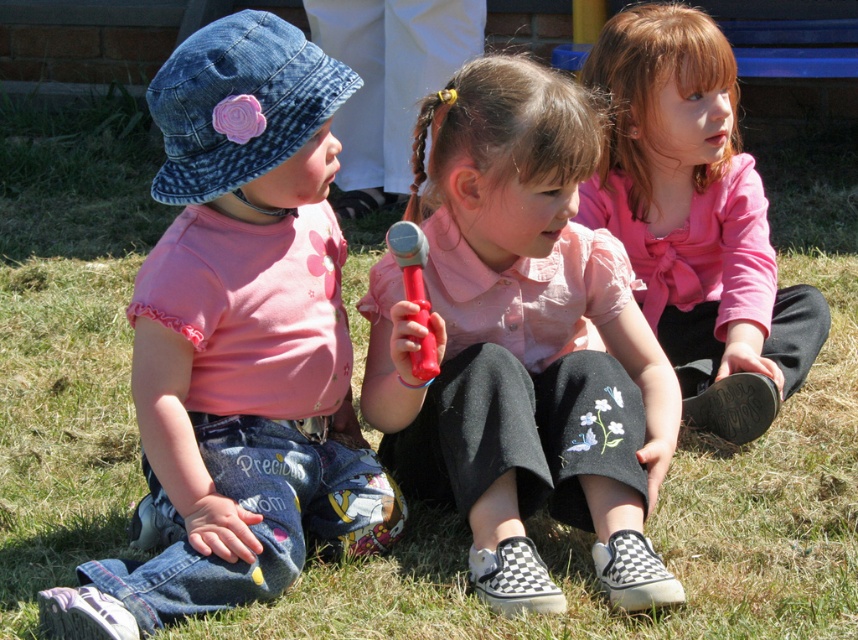
You are a photographer trying to capture a photo of the denim hat at left and the pink fabric shirt at center. Since you want to ensure both are clearly visible, which object should you focus on first to account for their sizes?

You should focus on the denim hat at left first because it is larger in size than the pink fabric shirt at center, making it easier to capture clearly.

You are a parent trying to decide which item to pick up first. The denim hat at left is taller than the red plastic hammer at center. Which item is taller?

The denim hat at left is taller than the red plastic hammer at center.

You are a photographer taking a picture of the three children. You want to ensure that the denim hat at left is centered in the frame. Where should you position the camera relative to the point at coordinates [239,344]?

The point at coordinates [239,344] corresponds to the denim hat at left, so you should position the camera directly facing this point to center the denim hat in the frame.